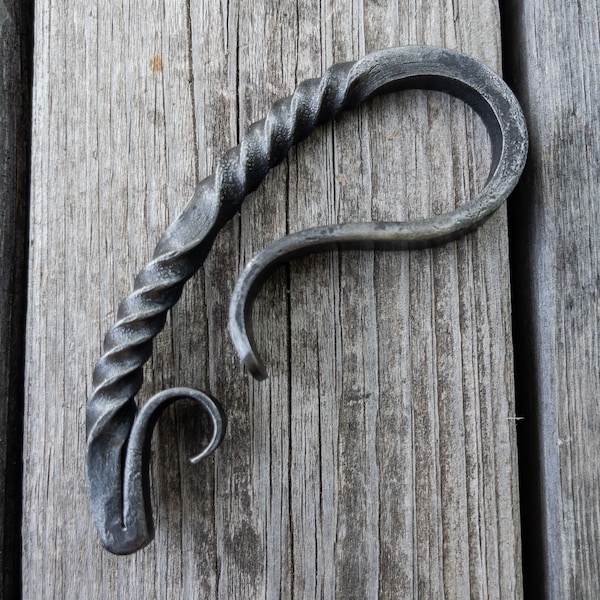
Identify the location of hook. (191, 394).